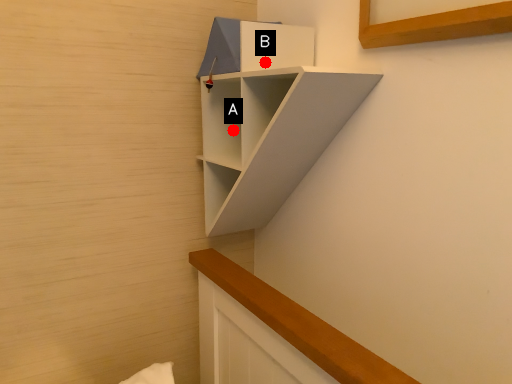
Question: Two points are circled on the image, labeled by A and B beside each circle. Which point is closer to the camera taking this photo?

Choices:
 (A) A is closer
 (B) B is closer

Answer: (B)